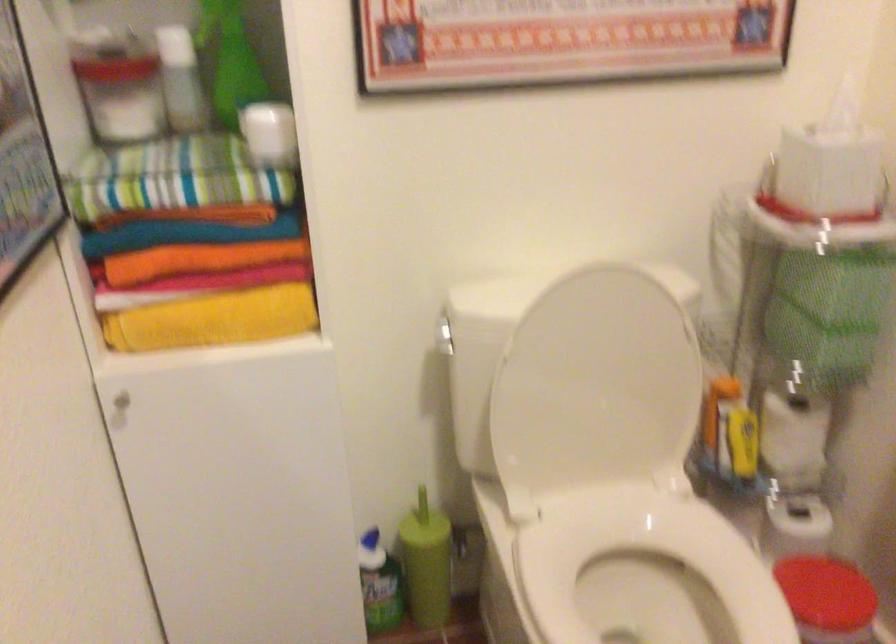
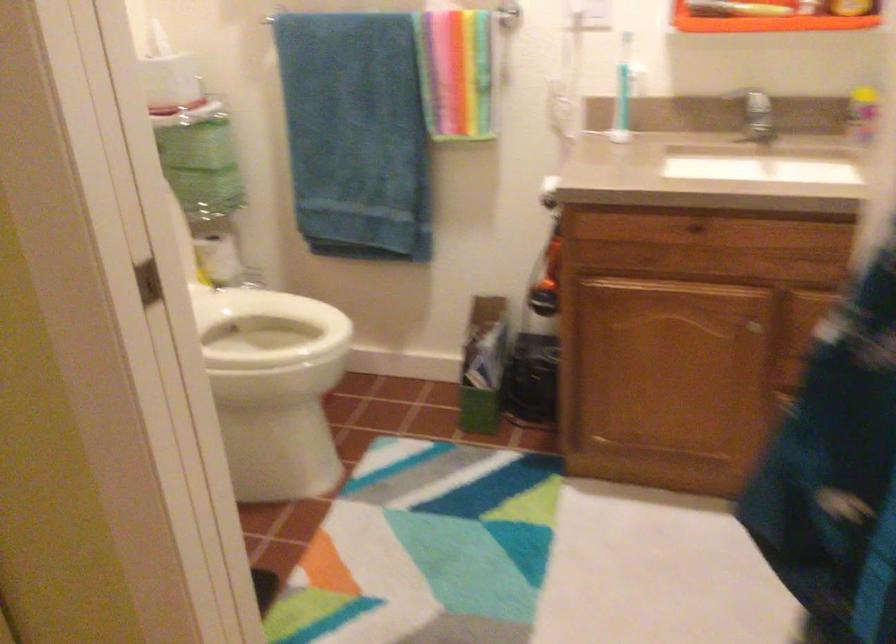
Question: I am providing you with two images of the same scene from different viewpoints. Please identify which objects are invisible in image2.

Choices:
 (A) black mop handle
 (B) white toilet seat
 (C) cabinet drawer knob
 (D) red trash can lid

Answer: (D)